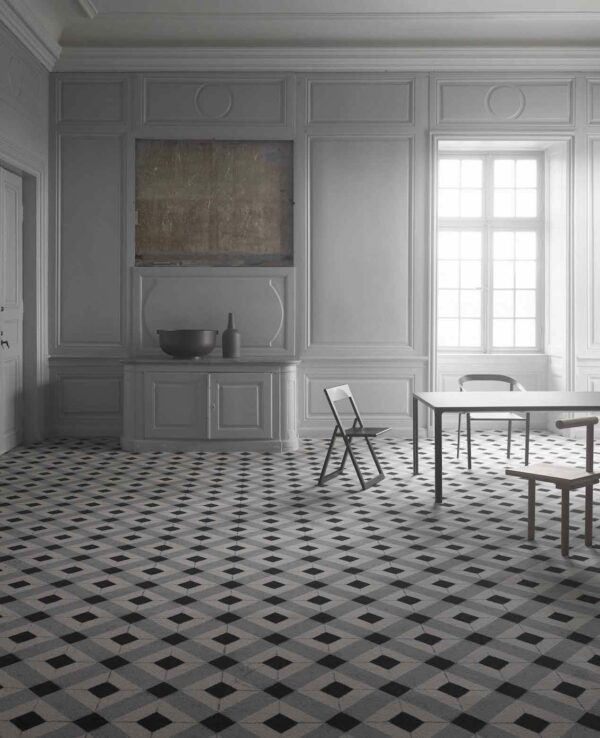
Locate an element on the screen. This screenshot has height=738, width=600. cabinet door is located at coordinates (241, 393), (174, 415).